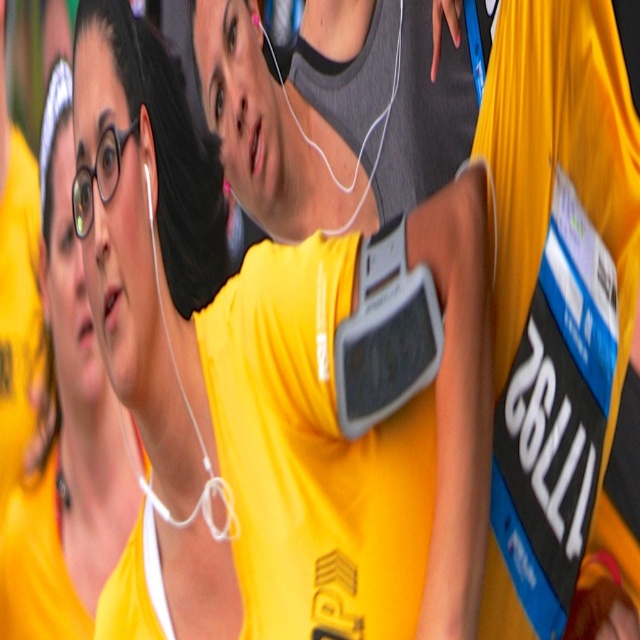
Question: Can you confirm if matte yellow shirt at center is wider than matte yellow shirt at left?

Choices:
 (A) no
 (B) yes

Answer: (B)

Question: Can you confirm if matte yellow shirt at center is bigger than matte yellow shirt at left?

Choices:
 (A) no
 (B) yes

Answer: (B)

Question: Where is matte yellow shirt at center located in relation to matte yellow shirt at left in the image?

Choices:
 (A) left
 (B) right

Answer: (B)